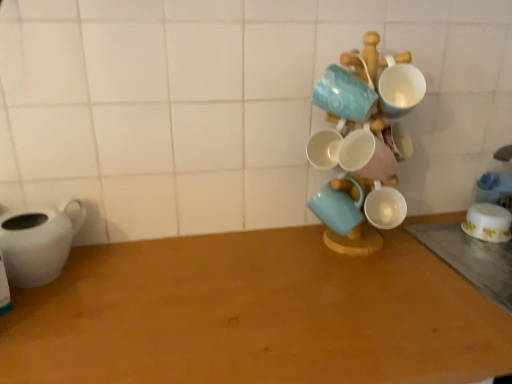
The image size is (512, 384). What do you see at coordinates (471, 258) in the screenshot? I see `wooden table at lower right, placed as the 1th table when sorted from right to left` at bounding box center [471, 258].

What do you see at coordinates (254, 315) in the screenshot? Image resolution: width=512 pixels, height=384 pixels. I see `wooden table at center, positioned as the 2th table in right-to-left order` at bounding box center [254, 315].

At what (x,y) coordinates should I click in order to perform the action: click on white glossy bowl at right, which appears as the 1th coffee cup when viewed from the back. Please return your answer as a coordinate pair (x, y). The width and height of the screenshot is (512, 384). Looking at the image, I should click on (488, 222).

Locate an element on the screen. This screenshot has height=384, width=512. matte ceramic mug at center, the 1th coffee cup when ordered from left to right is located at coordinates (335, 209).

At what (x,y) coordinates should I click in order to perform the action: click on the 1st coffee cup below when counting from the white glossy mugs at center-right (from the image's perspective). Please return your answer as a coordinate pair (x, y). Looking at the image, I should click on (335, 209).

From the image's perspective, is white glossy mugs at center-right above matte ceramic mug at center, the 1th coffee cup when ordered from left to right?

Indeed, from the image's perspective, white glossy mugs at center-right is shown above matte ceramic mug at center, the 1th coffee cup when ordered from left to right.

Is white glossy mugs at center-right located outside matte ceramic mug at center, the second coffee cup when ordered from back to front?

Absolutely, white glossy mugs at center-right is external to matte ceramic mug at center, the second coffee cup when ordered from back to front.

Considering the relative sizes of white glossy bowl at right, the 2th coffee cup when ordered from left to right, and white matte teapot at left in the image provided, is white glossy bowl at right, the 2th coffee cup when ordered from left to right, smaller than white matte teapot at left?

Yes, white glossy bowl at right, the 2th coffee cup when ordered from left to right, is smaller than white matte teapot at left.

Is white glossy bowl at right, which appears as the 1th coffee cup when viewed from the right, in front of white matte teapot at left?

No, white glossy bowl at right, which appears as the 1th coffee cup when viewed from the right, is further to the viewer.

Is white glossy bowl at right, the 2th coffee cup positioned from the front, wider than white matte teapot at left?

Incorrect, the width of white glossy bowl at right, the 2th coffee cup positioned from the front, does not surpass that of white matte teapot at left.

You are a GUI agent. You are given a task and a screenshot of the screen. Output one action in this format:
    pyautogui.click(x=<x>, y=<y>)
    Task: Click on the tableware located above the white glossy bowl at right, which appears as the 1th coffee cup when viewed from the back (from a real-world perspective)
    The width and height of the screenshot is (512, 384).
    Given the screenshot: What is the action you would take?
    pyautogui.click(x=38, y=243)

Measure the distance between wooden table at center, positioned as the 1th table in left-to-right order, and white matte teapot at left.

The distance of wooden table at center, positioned as the 1th table in left-to-right order, from white matte teapot at left is 12.52 inches.

In the scene shown: Is wooden table at center, positioned as the 1th table in left-to-right order, thinner than white matte teapot at left?

Incorrect, the width of wooden table at center, positioned as the 1th table in left-to-right order, is not less than that of white matte teapot at left.

From a real-world perspective, between wooden table at center, positioned as the 2th table in right-to-left order, and white matte teapot at left, who is vertically lower?

In real-world perspective, wooden table at center, positioned as the 2th table in right-to-left order, is lower.

Looking at the image, does matte ceramic mug at center, the first coffee cup viewed from the front, seem bigger or smaller compared to wooden table at center, positioned as the 2th table in right-to-left order?

matte ceramic mug at center, the first coffee cup viewed from the front, is smaller than wooden table at center, positioned as the 2th table in right-to-left order.

Does matte ceramic mug at center, the first coffee cup viewed from the front, have a lesser height compared to wooden table at center, positioned as the 2th table in right-to-left order?

Incorrect, the height of matte ceramic mug at center, the first coffee cup viewed from the front, does not fall short of that of wooden table at center, positioned as the 2th table in right-to-left order.

From a real-world perspective, between matte ceramic mug at center, the 1th coffee cup when ordered from left to right, and wooden table at center, positioned as the 2th table in right-to-left order, who is vertically higher?

From a 3D spatial view, matte ceramic mug at center, the 1th coffee cup when ordered from left to right, is above.

Considering the points (345, 205) and (138, 366), which point is in front, point (345, 205) or point (138, 366)?

The point (138, 366) is more forward.

From the image's perspective, who appears lower, white glossy bowl at right, which appears as the 1th coffee cup when viewed from the back, or white glossy mugs at center-right?

white glossy bowl at right, which appears as the 1th coffee cup when viewed from the back, is shown below in the image.

Is white glossy bowl at right, which appears as the 1th coffee cup when viewed from the right, facing away from white glossy mugs at center-right?

That's not correct — white glossy bowl at right, which appears as the 1th coffee cup when viewed from the right, is not looking away from white glossy mugs at center-right.

Between white glossy bowl at right, which appears as the 1th coffee cup when viewed from the back, and white glossy mugs at center-right, which one has larger width?

white glossy mugs at center-right.

From the image's perspective, would you say matte ceramic mug at center, the first coffee cup viewed from the front, is shown under wooden table at lower right, placed as the 1th table when sorted from right to left?

Actually, matte ceramic mug at center, the first coffee cup viewed from the front, appears above wooden table at lower right, placed as the 1th table when sorted from right to left, in the image.

Does point (334, 216) lie behind point (453, 223)?

No, it is not.

Does matte ceramic mug at center, the second coffee cup when ordered from back to front, turn towards wooden table at lower right, placed as the second table when sorted from left to right?

No, matte ceramic mug at center, the second coffee cup when ordered from back to front, is not oriented towards wooden table at lower right, placed as the second table when sorted from left to right.

Would you say white glossy bowl at right, the 2th coffee cup positioned from the front, is to the left or to the right of wooden table at center, positioned as the 1th table in left-to-right order, in the picture?

Based on their positions, white glossy bowl at right, the 2th coffee cup positioned from the front, is located to the right of wooden table at center, positioned as the 1th table in left-to-right order.

Is white glossy bowl at right, which appears as the 1th coffee cup when viewed from the back, taller or shorter than wooden table at center, positioned as the 2th table in right-to-left order?

Considering their sizes, white glossy bowl at right, which appears as the 1th coffee cup when viewed from the back, has more height than wooden table at center, positioned as the 2th table in right-to-left order.

Considering the relative sizes of white glossy bowl at right, the 2th coffee cup positioned from the front, and wooden table at center, positioned as the 1th table in left-to-right order, in the image provided, is white glossy bowl at right, the 2th coffee cup positioned from the front, smaller than wooden table at center, positioned as the 1th table in left-to-right order,?

Correct, white glossy bowl at right, the 2th coffee cup positioned from the front, occupies less space than wooden table at center, positioned as the 1th table in left-to-right order.

Is white glossy bowl at right, which appears as the 1th coffee cup when viewed from the right, not close to wooden table at center, positioned as the 1th table in left-to-right order?

white glossy bowl at right, which appears as the 1th coffee cup when viewed from the right, is near wooden table at center, positioned as the 1th table in left-to-right order, not far away.

Find the location of a particular element. This screenshot has width=512, height=384. the 1st coffee cup behind the white glossy mugs at center-right, starting your count from the anchor is located at coordinates (335, 209).

Locate an element on the screen. The image size is (512, 384). tableware lying on the left of white glossy bowl at right, which appears as the 1th coffee cup when viewed from the back is located at coordinates (x=38, y=243).

Considering their positions, is wooden table at lower right, placed as the 1th table when sorted from right to left, positioned closer to wooden table at center, positioned as the 1th table in left-to-right order, than white matte teapot at left?

The object closer to wooden table at center, positioned as the 1th table in left-to-right order, is white matte teapot at left.

When comparing their distances from white glossy mugs at center-right, does wooden table at center, positioned as the 2th table in right-to-left order, or matte ceramic mug at center, the second coffee cup when ordered from back to front, seem closer?

The object closer to white glossy mugs at center-right is matte ceramic mug at center, the second coffee cup when ordered from back to front.

Considering their positions, is white glossy mugs at center-right positioned closer to white matte teapot at left than wooden table at lower right, placed as the second table when sorted from left to right?

Among the two, white glossy mugs at center-right is located nearer to white matte teapot at left.

When comparing their distances from wooden table at lower right, placed as the 1th table when sorted from right to left, does wooden table at center, positioned as the 2th table in right-to-left order, or white glossy bowl at right, which appears as the 1th coffee cup when viewed from the back, seem closer?

white glossy bowl at right, which appears as the 1th coffee cup when viewed from the back.

Estimate the real-world distances between objects in this image. Which object is closer to wooden table at lower right, placed as the 1th table when sorted from right to left, white glossy bowl at right, the 2th coffee cup positioned from the front, or matte ceramic mug at center, which ranks as the 2th coffee cup in right-to-left order?

Based on the image, white glossy bowl at right, the 2th coffee cup positioned from the front, appears to be nearer to wooden table at lower right, placed as the 1th table when sorted from right to left.

Which object lies nearer to the anchor point wooden table at center, positioned as the 2th table in right-to-left order, matte ceramic mug at center, which ranks as the 2th coffee cup in right-to-left order, or white glossy mugs at center-right?

The object closer to wooden table at center, positioned as the 2th table in right-to-left order, is white glossy mugs at center-right.

Looking at the image, which one is located closer to wooden table at lower right, placed as the second table when sorted from left to right, white glossy bowl at right, the 2th coffee cup positioned from the front, or white glossy mugs at center-right?

white glossy bowl at right, the 2th coffee cup positioned from the front.

Based on their spatial positions, is white glossy bowl at right, which appears as the 1th coffee cup when viewed from the back, or white glossy mugs at center-right closer to matte ceramic mug at center, which ranks as the 2th coffee cup in right-to-left order?

white glossy mugs at center-right is closer to matte ceramic mug at center, which ranks as the 2th coffee cup in right-to-left order.

Find the location of `coffee cup between matte ceramic mug at center, the first coffee cup viewed from the front, and wooden table at lower right, placed as the second table when sorted from left to right`. coffee cup between matte ceramic mug at center, the first coffee cup viewed from the front, and wooden table at lower right, placed as the second table when sorted from left to right is located at coordinates (488, 222).

Where is `table between white matte teapot at left and white glossy mugs at center-right from left to right`? table between white matte teapot at left and white glossy mugs at center-right from left to right is located at coordinates (254, 315).

Find the location of `coffee cup between white glossy mugs at center-right and wooden table at lower right, placed as the second table when sorted from left to right, from left to right`. coffee cup between white glossy mugs at center-right and wooden table at lower right, placed as the second table when sorted from left to right, from left to right is located at coordinates (488, 222).

At what (x,y) coordinates should I click in order to perform the action: click on coffee cup between white matte teapot at left and white glossy bowl at right, the 2th coffee cup when ordered from left to right, in the horizontal direction. Please return your answer as a coordinate pair (x, y). The image size is (512, 384). Looking at the image, I should click on (335, 209).